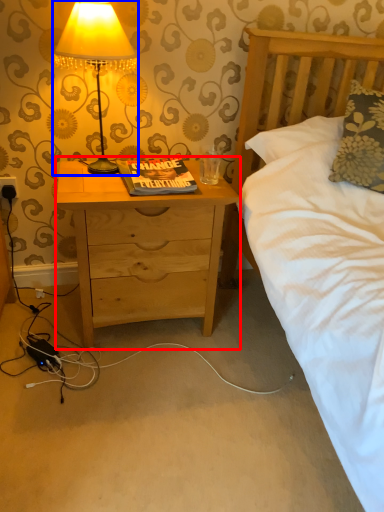
Question: Which object is further to the camera taking this photo, nightstand (highlighted by a red box) or lamp (highlighted by a blue box)?

Choices:
 (A) nightstand
 (B) lamp

Answer: (A)